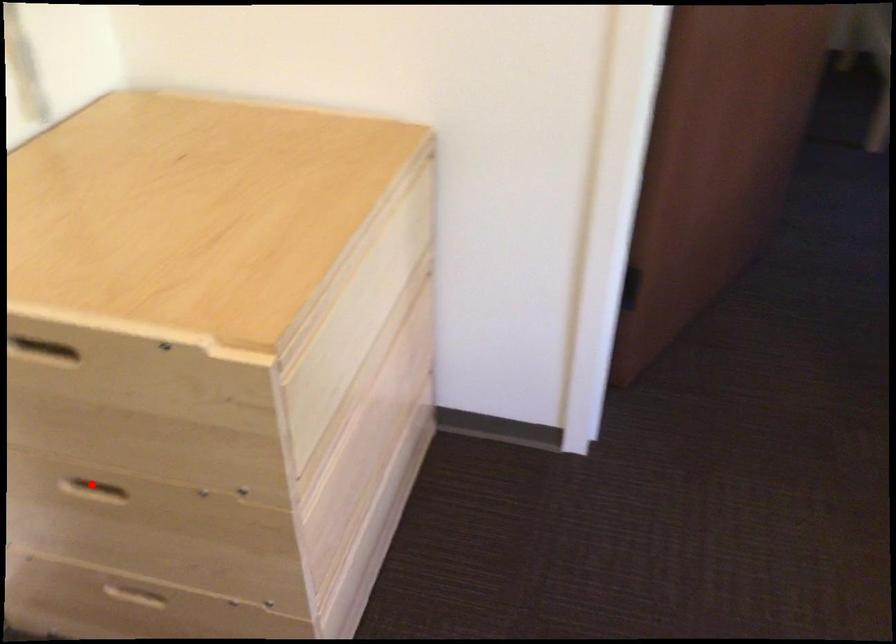
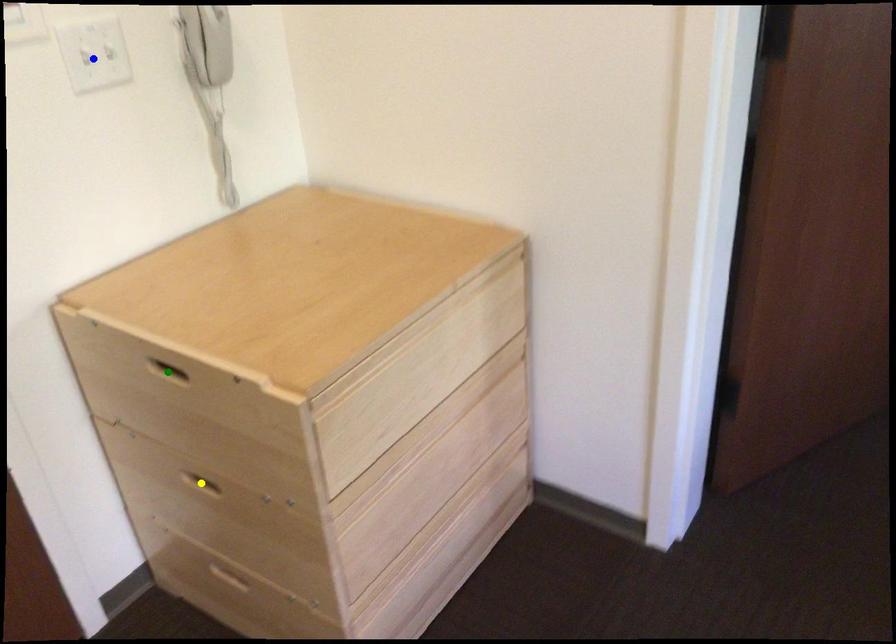
Question: I am providing you with two images of the same scene from different viewpoints. A red point is marked on the first image. You are given multiple points on the second image. Can you choose the point in image 2 that corresponds to the point in image 1?

Choices:
 (A) blue point
 (B) yellow point
 (C) green point

Answer: (B)